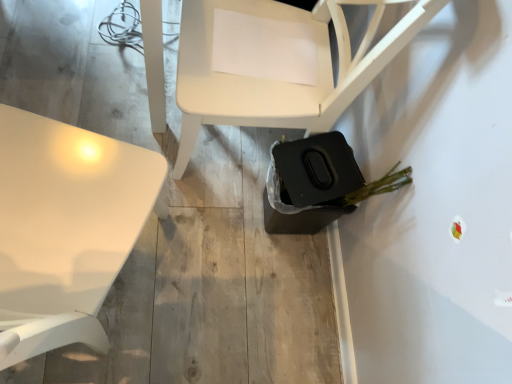
The image size is (512, 384). Find the location of `free point below matte white chair at center (from a real-world perspective)`. free point below matte white chair at center (from a real-world perspective) is located at coordinates (234, 145).